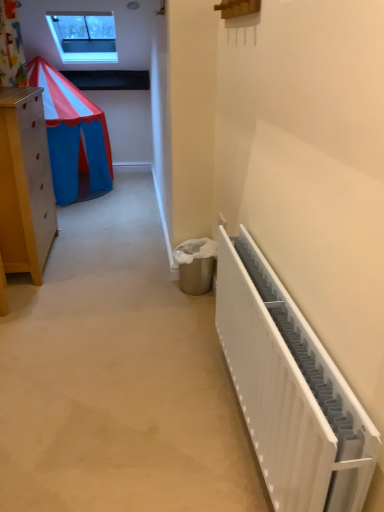
Question: Can we say white matte radiator at right lies outside transparent glass window at upper center?

Choices:
 (A) yes
 (B) no

Answer: (A)

Question: Does white matte radiator at right come in front of transparent glass window at upper center?

Choices:
 (A) no
 (B) yes

Answer: (B)

Question: Considering the relative positions of white matte radiator at right and transparent glass window at upper center in the image provided, is white matte radiator at right to the left of transparent glass window at upper center from the viewer's perspective?

Choices:
 (A) no
 (B) yes

Answer: (A)

Question: Does white matte radiator at right have a smaller size compared to transparent glass window at upper center?

Choices:
 (A) yes
 (B) no

Answer: (A)

Question: Is white matte radiator at right looking in the opposite direction of transparent glass window at upper center?

Choices:
 (A) no
 (B) yes

Answer: (A)

Question: Can you confirm if white matte radiator at right is bigger than transparent glass window at upper center?

Choices:
 (A) no
 (B) yes

Answer: (A)

Question: Does transparent glass window at upper center have a larger size compared to white matte radiator at right?

Choices:
 (A) yes
 (B) no

Answer: (A)

Question: Does transparent glass window at upper center have a greater width compared to white matte radiator at right?

Choices:
 (A) no
 (B) yes

Answer: (B)

Question: Can you confirm if transparent glass window at upper center is smaller than white matte radiator at right?

Choices:
 (A) yes
 (B) no

Answer: (B)

Question: From a real-world perspective, is transparent glass window at upper center below white matte radiator at right?

Choices:
 (A) yes
 (B) no

Answer: (B)

Question: Is transparent glass window at upper center in front of white matte radiator at right?

Choices:
 (A) yes
 (B) no

Answer: (B)

Question: From the image's perspective, is transparent glass window at upper center located above white matte radiator at right?

Choices:
 (A) no
 (B) yes

Answer: (B)

Question: Does point (271, 413) appear closer or farther from the camera than point (66, 26)?

Choices:
 (A) closer
 (B) farther

Answer: (A)